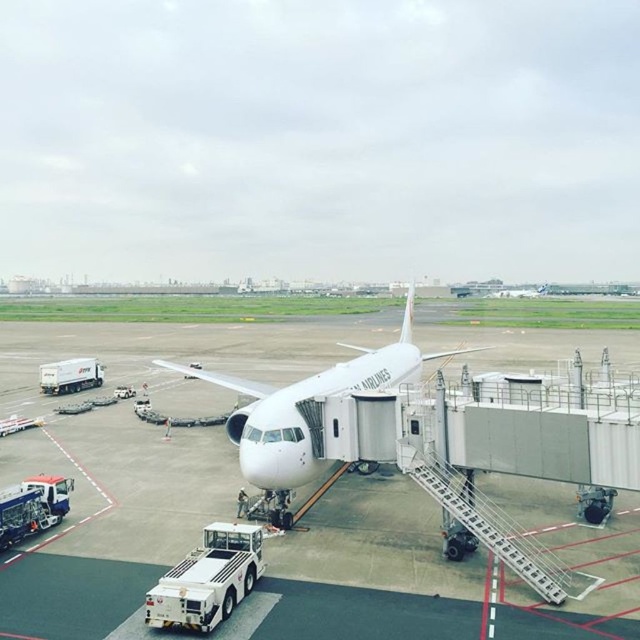
You are standing at the point marked as point (147, 426) in the airport tarmac scene. What surface are you currently standing on?

The point (147, 426) is on white smooth tarmac at center, so you are standing on the white smooth tarmac at center.

Looking at this image, you are a maintenance worker needing to access the front landing gear of the white glossy airplane at center. The white smooth tarmac at center is in front of the airplane. Can you drive a small service vehicle directly towards the airplane along the tarmac without obstruction?

The white smooth tarmac at center is in front of the white glossy airplane at center, so yes, you can drive a small service vehicle directly towards the airplane along the tarmac without obstruction since the tarmac is positioned in front of the aircraft.